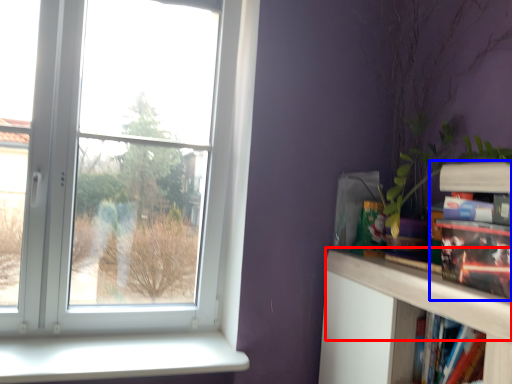
Question: Which of the following is the closest to the observer, mantle (highlighted by a red box) or book (highlighted by a blue box)?

Choices:
 (A) mantle
 (B) book

Answer: (A)